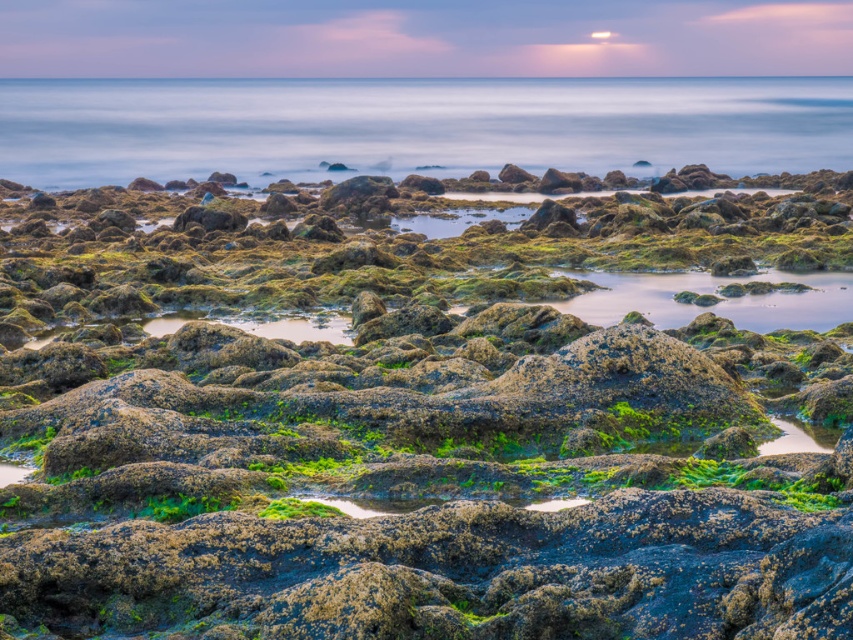
You are standing on the beach and see the green mossy rock at center and the smooth water at center. Which object is located closer to the ground?

The green mossy rock at center is positioned under the smooth water at center, meaning it is closer to the ground.

You are standing on the beach and want to place a small statue on the green mossy rock at center so it can be seen from the smooth water at center. Will the statue be visible from the water? Explain why.

The green mossy rock at center has a lesser height compared to smooth water at center, so the statue placed on the rock may not be fully visible from the water because the water level is higher than the rock.

You are standing on the rocky shoreline and want to reach the smooth water at center without stepping on the green mossy rock at center. Which direction should you move relative to the rock?

You should move to the left of the green mossy rock at center to reach the smooth water at center since the rock is positioned to the right of the water.